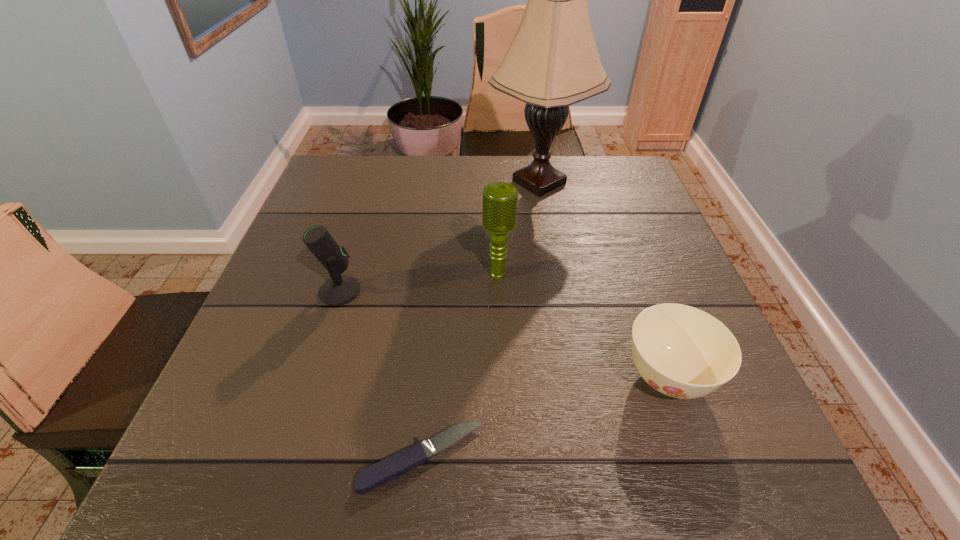
In order to click on object located in the far right corner section of the desktop in this screenshot , I will do `click(553, 62)`.

Where is `free region at the far edge of the desktop`? This screenshot has width=960, height=540. free region at the far edge of the desktop is located at coordinates (485, 179).

This screenshot has width=960, height=540. In the image, there is a desktop. What are the coordinates of `free space at the left edge` in the screenshot? It's located at (208, 426).

What are the coordinates of `vacant space at the right edge of the desktop` in the screenshot? It's located at (668, 258).

At what (x,y) coordinates should I click in order to perform the action: click on free location at the far left corner. Please return your answer as a coordinate pair (x, y). The height and width of the screenshot is (540, 960). Looking at the image, I should click on (358, 195).

Find the location of `free space at the far right corner`. free space at the far right corner is located at coordinates (608, 168).

This screenshot has width=960, height=540. In the image, there is a desktop. Identify the location of free region at the near right corner. (714, 473).

This screenshot has height=540, width=960. I want to click on vacant point located between the left microphone and the second tallest object, so click(419, 283).

Locate an element on the screen. This screenshot has width=960, height=540. free space between the sugar bowl and the steak knife is located at coordinates (545, 418).

Locate an element on the screen. empty space between the taller microphone and the leftmost object is located at coordinates (419, 283).